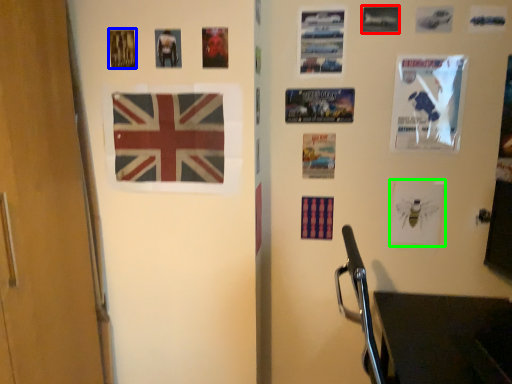
Question: Which object is positioned closest to poster page (highlighted by a red box)? Select from poster page (highlighted by a blue box) and poster page (highlighted by a green box).

Choices:
 (A) poster page
 (B) poster page

Answer: (B)